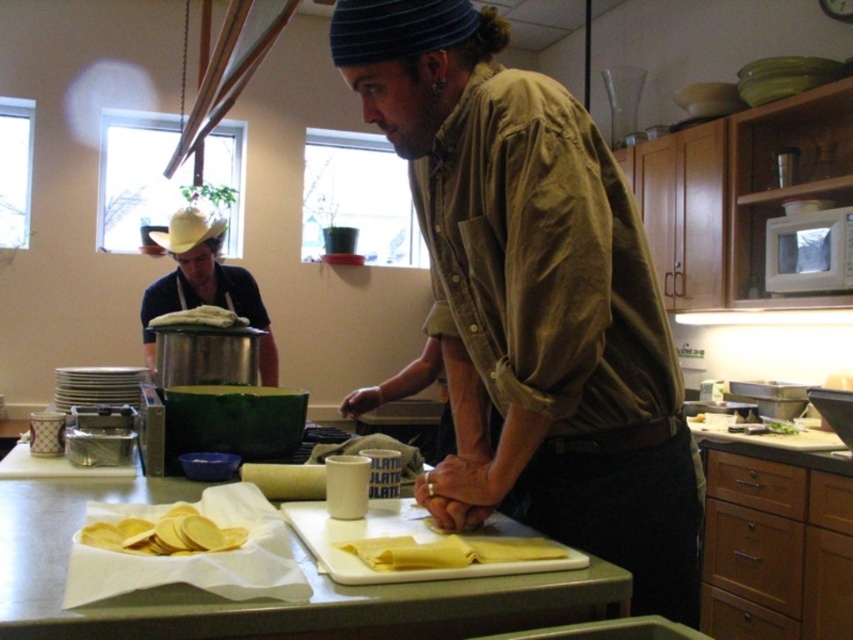
You are standing in the kitchen and need to locate the brown corduroy shirt at center. According to the coordinates provided, where exactly is it positioned?

The brown corduroy shirt at center is positioned at coordinates point (532, 298).

You are a drone operator trying to capture a closeup of the two points in the kitchen scene. The first point is at coordinate point (408,54) and the second point is at coordinate point (218,230). Since you can only focus on one point at a time, which point should you prioritize to get a clearer image?

Point (408,54) is closer to the camera than point (218,230), so you should prioritize capturing the point (408,54) for a clearer image.